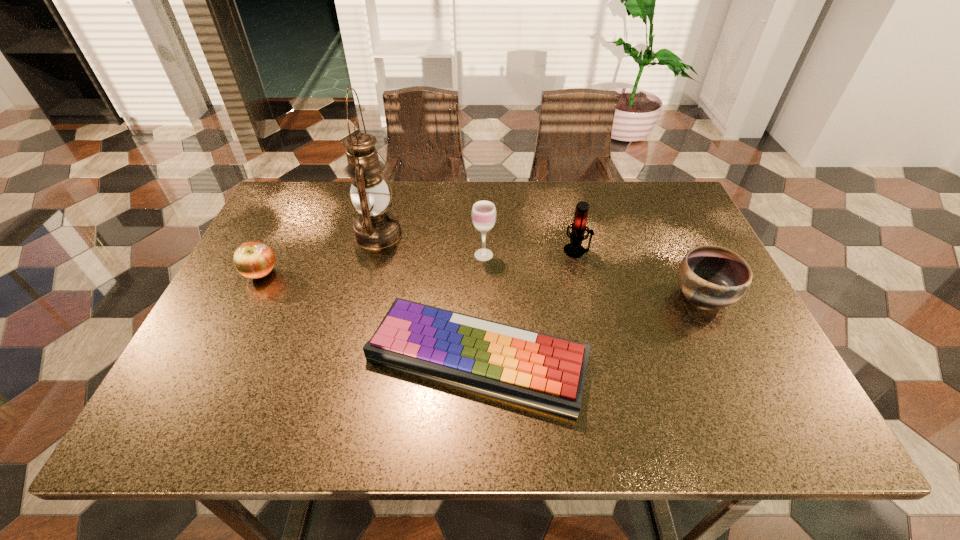
In the image, there is a desktop. Find the location of `free space at the far right corner`. free space at the far right corner is located at coordinates (660, 192).

This screenshot has width=960, height=540. I want to click on vacant region at the near right corner of the desktop, so click(x=749, y=422).

You are a GUI agent. You are given a task and a screenshot of the screen. Output one action in this format:
    pyautogui.click(x=<x>, y=<y>)
    Task: Click on the vacant area that lies between the oil lamp and the microphone
    Image resolution: width=960 pixels, height=540 pixels.
    Given the screenshot: What is the action you would take?
    pyautogui.click(x=477, y=242)

I want to click on empty location between the bowl and the wineglass, so click(593, 275).

Where is `vacant area between the shortest object and the wineglass`? This screenshot has height=540, width=960. vacant area between the shortest object and the wineglass is located at coordinates (481, 306).

Identify the location of vacant area that lies between the wineglass and the computer keyboard. (481, 306).

At what (x,y) coordinates should I click in order to perform the action: click on free space between the oil lamp and the microphone. Please return your answer as a coordinate pair (x, y). The width and height of the screenshot is (960, 540). Looking at the image, I should click on (477, 242).

Identify the location of vacant point located between the microphone and the wineglass. (530, 253).

Locate an element on the screen. vacant space that's between the apple and the tallest object is located at coordinates (320, 254).

Find the location of a particular element. unoccupied position between the wineglass and the microphone is located at coordinates (530, 253).